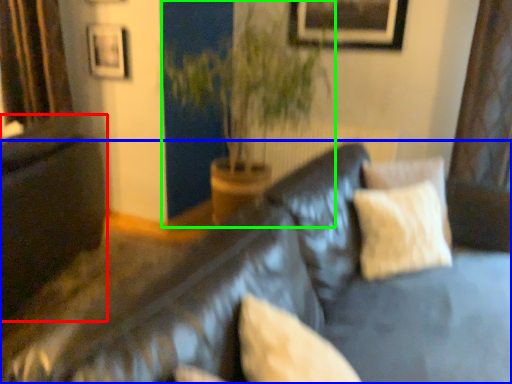
Question: Which is farther away from dark (highlighted by a red box)? studio couch (highlighted by a blue box) or houseplant (highlighted by a green box)?

Choices:
 (A) studio couch
 (B) houseplant

Answer: (A)